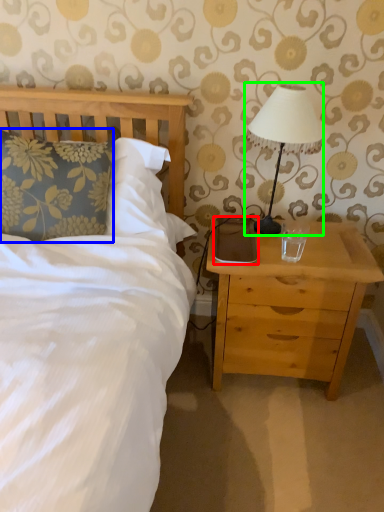
Question: Considering the real-world distances, which object is farthest from pad (highlighted by a red box)? pillow (highlighted by a blue box) or table lamp (highlighted by a green box)?

Choices:
 (A) pillow
 (B) table lamp

Answer: (A)